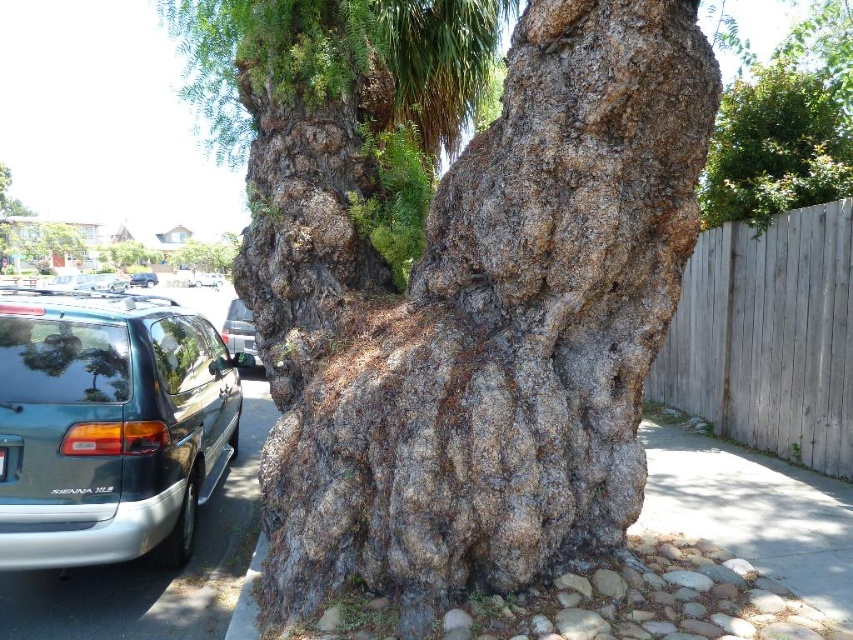
Can you confirm if green leafy tree at upper right is smaller than matte black van at center?

Incorrect, green leafy tree at upper right is not smaller in size than matte black van at center.

Where is `green leafy tree at upper right`? green leafy tree at upper right is located at coordinates (776, 145).

This screenshot has height=640, width=853. What are the coordinates of `green leafy tree at upper right` in the screenshot? It's located at (776, 145).

Is gray concrete curb at lower center wider than metallic silver minivan at center?

Incorrect, gray concrete curb at lower center's width does not surpass metallic silver minivan at center's.

Between gray concrete curb at lower center and metallic silver minivan at center, which one appears on the left side from the viewer's perspective?

metallic silver minivan at center

Find the location of `gray concrete curb at lower center`. gray concrete curb at lower center is located at coordinates (248, 596).

Does teal matte van at left lie behind metallic silver minivan at center?

No, it is not.

Which is in front, point (57, 524) or point (254, 332)?

Point (57, 524) is more forward.

Measure the distance between teal matte van at left and camera.

12.24 feet

I want to click on teal matte van at left, so click(x=108, y=426).